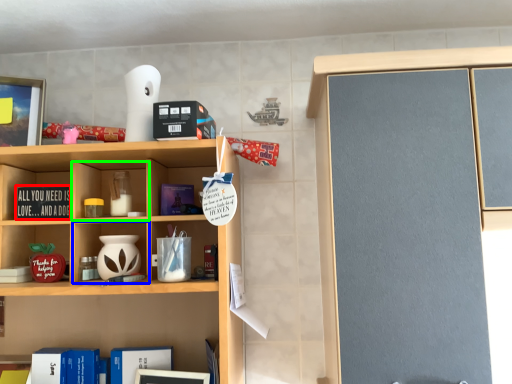
Question: Estimate the real-world distances between objects in this image. Which object is closer to book (highlighted by a red box), cabinet (highlighted by a blue box) or cabinet (highlighted by a green box)?

Choices:
 (A) cabinet
 (B) cabinet

Answer: (B)